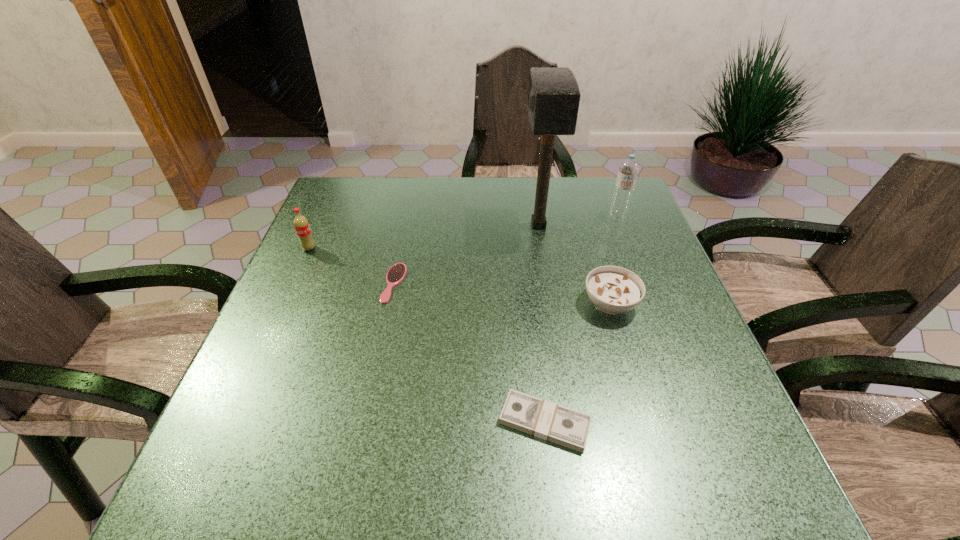
Where is `vacant region located on the left of the second tallest object`? The width and height of the screenshot is (960, 540). vacant region located on the left of the second tallest object is located at coordinates (580, 216).

This screenshot has width=960, height=540. I want to click on vacant region located on the right of the third tallest object, so click(x=451, y=248).

This screenshot has height=540, width=960. What are the coordinates of `free spot located 0.070m on the left of the soup bowl` in the screenshot? It's located at (551, 303).

Where is `free space located 0.230m on the left of the second object from left to right`? The image size is (960, 540). free space located 0.230m on the left of the second object from left to right is located at coordinates (287, 283).

Where is `vacant space located 0.120m on the left of the nearest object`? The height and width of the screenshot is (540, 960). vacant space located 0.120m on the left of the nearest object is located at coordinates (431, 422).

This screenshot has height=540, width=960. I want to click on mallet present at the far edge, so click(x=553, y=97).

Find the location of a particular element. The width and height of the screenshot is (960, 540). water bottle located in the far edge section of the desktop is located at coordinates (628, 170).

At what (x,y) coordinates should I click in order to perform the action: click on object at the left edge. Please return your answer as a coordinate pair (x, y). The height and width of the screenshot is (540, 960). Looking at the image, I should click on (301, 224).

Where is `water bottle located at the right edge`? The height and width of the screenshot is (540, 960). water bottle located at the right edge is located at coordinates (628, 170).

Identify the location of soup bowl that is at the right edge. The image size is (960, 540). (614, 290).